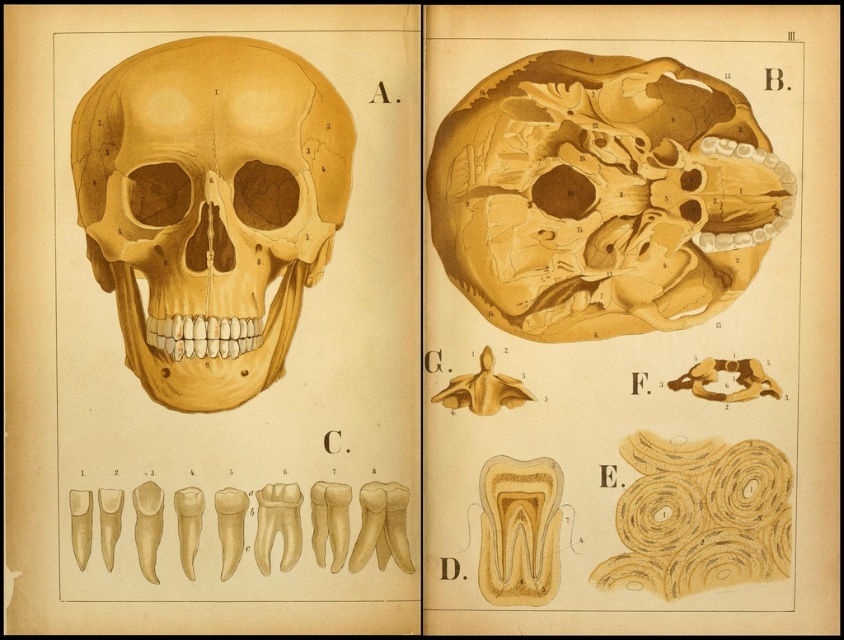
You are a medical student analyzing the two matte yellow skull views in the illustration. Which view, the matte yellow skull at upper right or the matte yellow skull at center, has a greater height?

The matte yellow skull at center has a greater height because the matte yellow skull at upper right is shorter than it.

You are a medical student analyzing the anatomical illustration described. You need to locate the matte yellow skull at upper right for your study. According to the coordinates provided, where exactly should you focus your attention on the illustration?

The matte yellow skull at upper right is positioned at coordinates point (602, 195), so you should focus your attention at that specific coordinate point on the illustration.